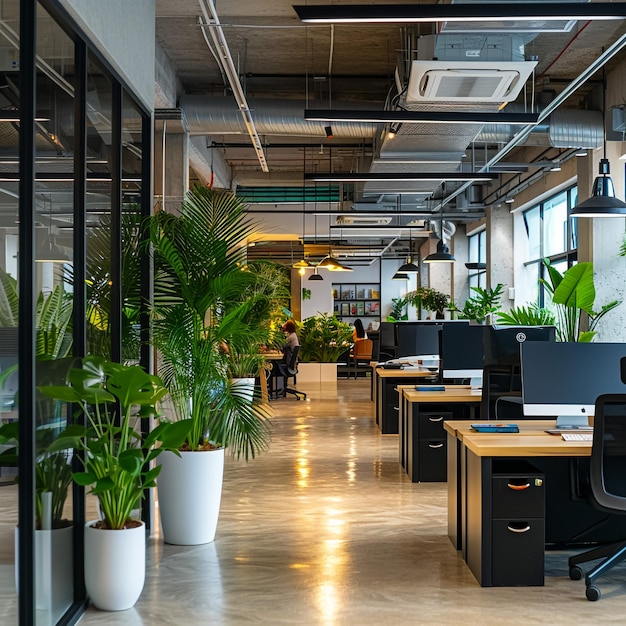
The width and height of the screenshot is (626, 626). I want to click on white planters sitting on left side of office room, so click(x=126, y=556), click(x=193, y=494).